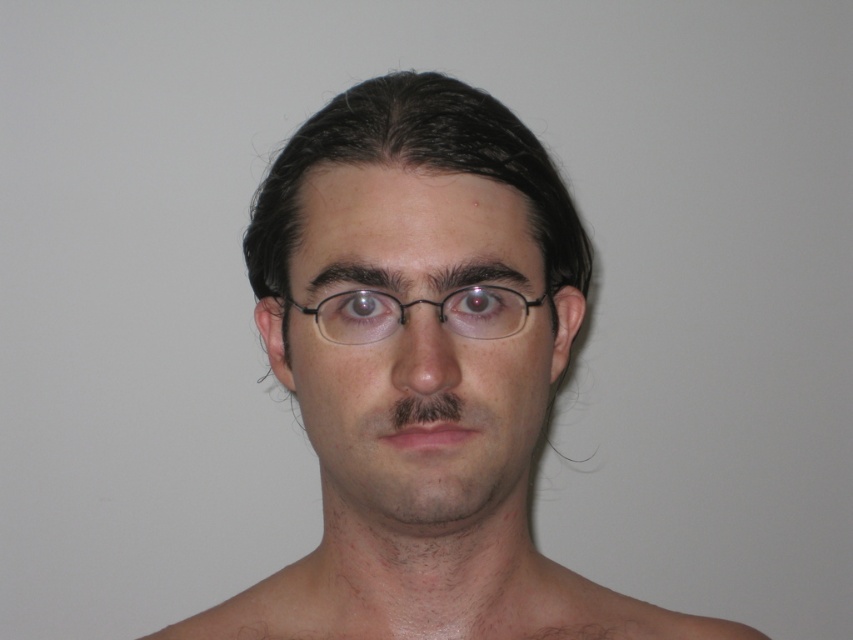
Consider the image. You are a photographer adjusting the focus of your camera. The subject is a smooth skin man at center and a smooth skin face at center. Since the camera can only focus on one subject at a time, which one should you choose to ensure the face is sharp? Please explain your reasoning based on their positions.

→ The smooth skin face at center is part of the smooth skin man at center. Since they are only 0.79 inches apart, focusing on the smooth skin face at center will ensure the man at center is also in focus, making the face sharp.

Looking at the portrait of the smooth skin man at center and the black plastic glasses at center, which object takes up more space in the image?

The smooth skin man at center is larger in size than the black plastic glasses at center, so the smooth skin man at center takes up more space in the image.

Looking at the portrait of the smooth skin man at center and the smooth skin face at center, which one has a larger area in the image?

The smooth skin man at center is bigger than smooth skin face at center, so the smooth skin man at center has a larger area in the image.